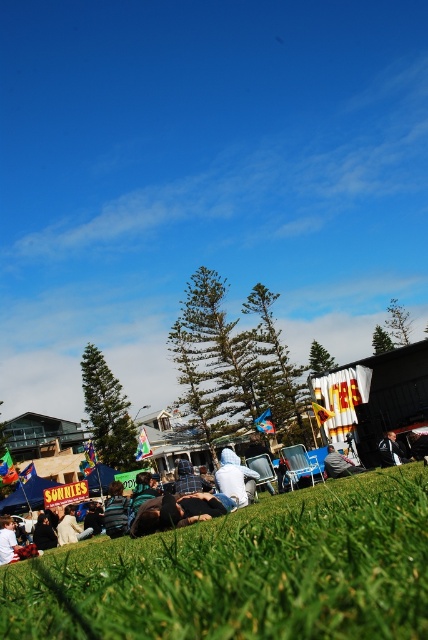
Question: Is green grassy field at lower center behind white fabric at center?

Choices:
 (A) yes
 (B) no

Answer: (B)

Question: Considering the real-world distances, which object is closest to the white fabric umbrella at center?

Choices:
 (A) white fabric at center
 (B) green grassy field at lower center

Answer: (A)

Question: Among these objects, which one is farthest from the camera?

Choices:
 (A) green grassy field at lower center
 (B) white fabric at center

Answer: (B)

Question: Does green grassy field at lower center have a smaller size compared to black leather jacket at center?

Choices:
 (A) no
 (B) yes

Answer: (A)

Question: Where is white fabric at center located in relation to white fabric umbrella at center in the image?

Choices:
 (A) left
 (B) right

Answer: (A)

Question: Which is farther from the white fabric umbrella at center?

Choices:
 (A) black leather jacket at center
 (B) white fabric at center
 (C) green grassy field at lower center

Answer: (C)